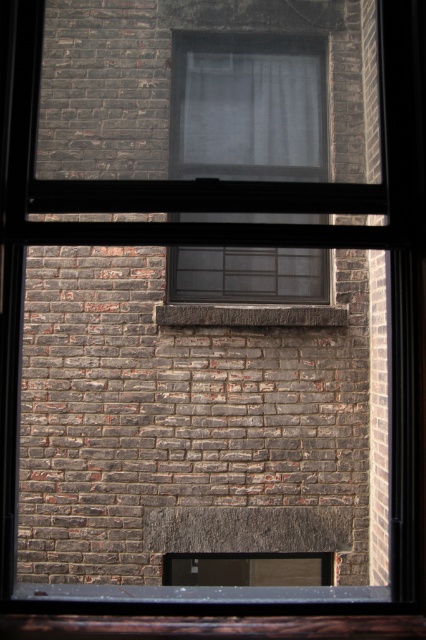
Question: Is clear glass window at center to the left of white sheer curtain at center from the viewer's perspective?

Choices:
 (A) no
 (B) yes

Answer: (B)

Question: Which object is the farthest from the brown stone window sill at center?

Choices:
 (A) clear glass window at center
 (B) white sheer curtain at center

Answer: (B)

Question: Observing the image, what is the correct spatial positioning of clear glass window at center in reference to brown stone window sill at center?

Choices:
 (A) below
 (B) above

Answer: (B)

Question: Which point appears closest to the camera in this image?

Choices:
 (A) (284, 104)
 (B) (282, 125)
 (C) (290, 321)

Answer: (C)

Question: Can you confirm if clear glass window at center is thinner than white sheer curtain at center?

Choices:
 (A) no
 (B) yes

Answer: (A)

Question: Which of the following is the closest to the observer?

Choices:
 (A) clear glass window at center
 (B) white sheer curtain at center

Answer: (A)